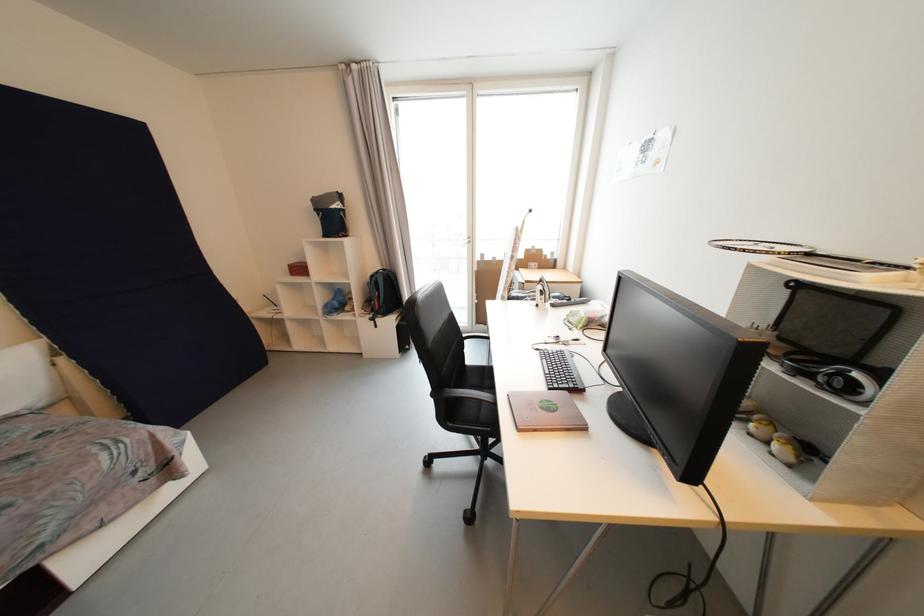
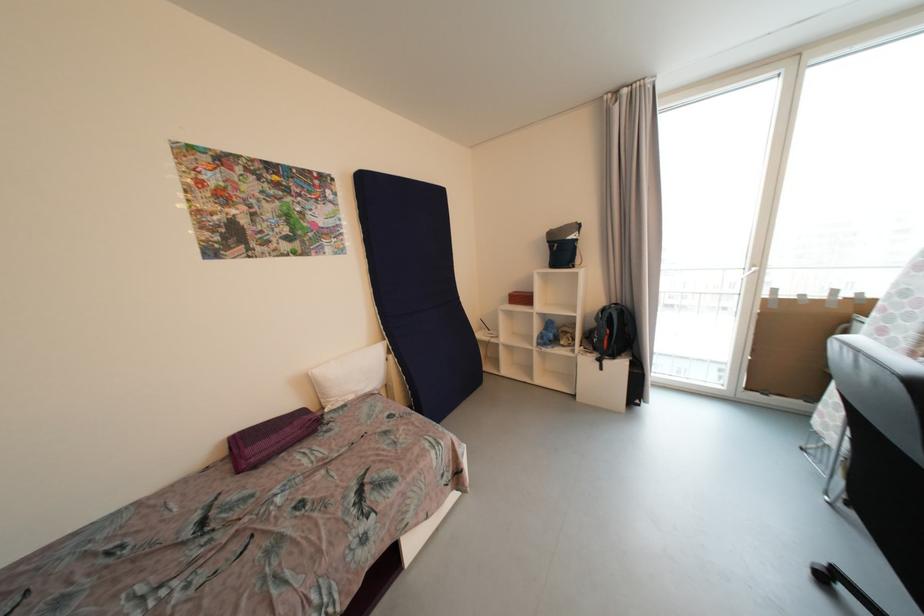
Locate, in the second image, the point that corresponds to pixel 67 361 in the first image.

(396, 359)